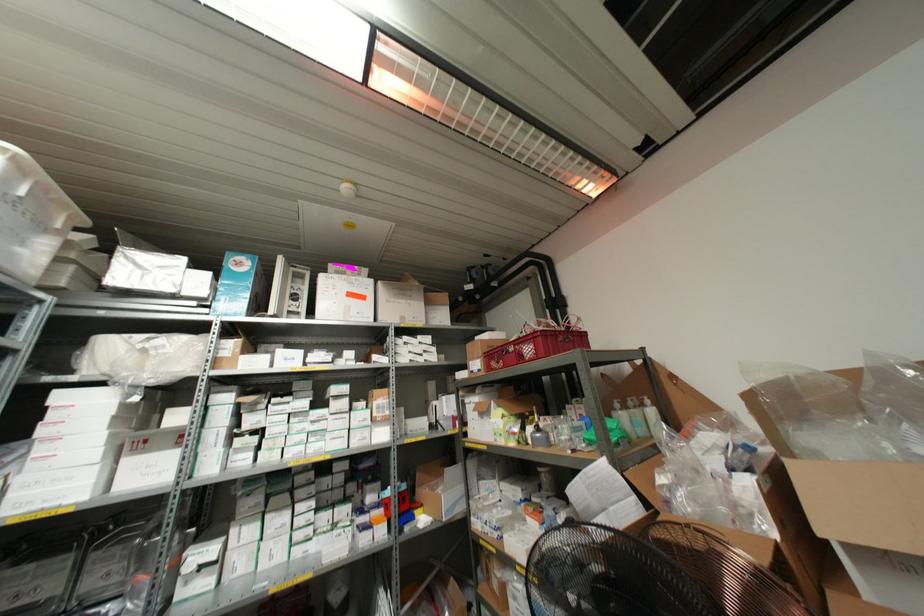
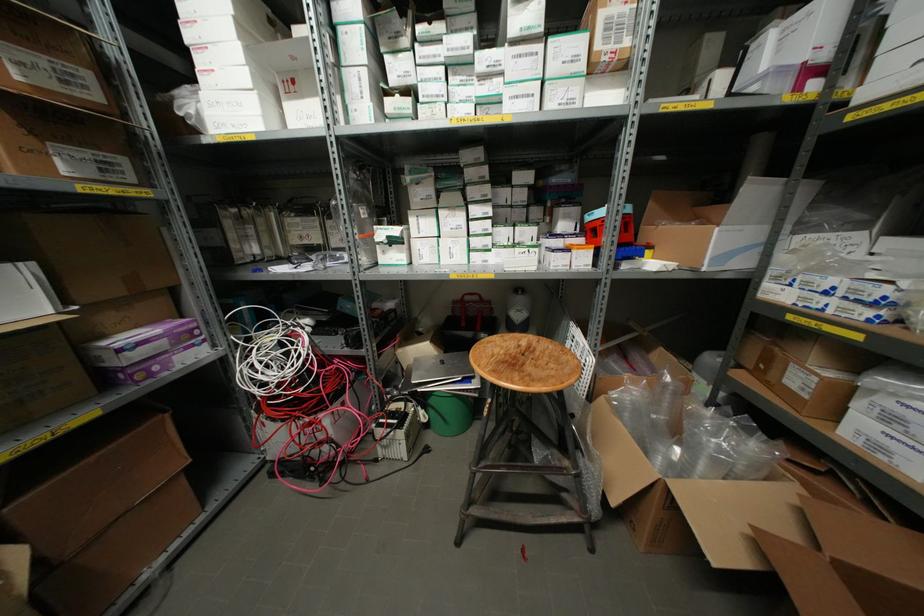
Find the pixel in the second image that matches (x=233, y=531) in the first image.

(410, 219)